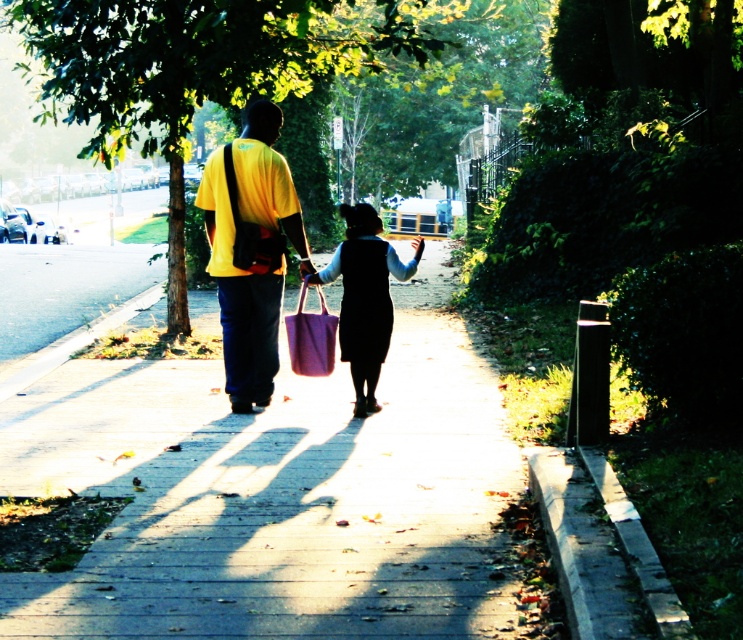
Question: Does smooth concrete sidewalk at center lie in front of yellow matte shirt at center?

Choices:
 (A) yes
 (B) no

Answer: (A)

Question: Where is smooth concrete sidewalk at center located in relation to matte purple bag at center in the image?

Choices:
 (A) below
 (B) above

Answer: (A)

Question: Considering the relative positions of smooth concrete sidewalk at center and yellow matte shirt at center in the image provided, where is smooth concrete sidewalk at center located with respect to yellow matte shirt at center?

Choices:
 (A) left
 (B) right

Answer: (B)

Question: Which point is farther to the camera?

Choices:
 (A) yellow matte shirt at center
 (B) matte purple bag at center

Answer: (B)

Question: Which point is farther to the camera?

Choices:
 (A) (398, 436)
 (B) (354, 275)
 (C) (276, 186)

Answer: (C)

Question: Which point is closer to the camera taking this photo?

Choices:
 (A) (502, 451)
 (B) (282, 278)
 (C) (389, 262)

Answer: (A)